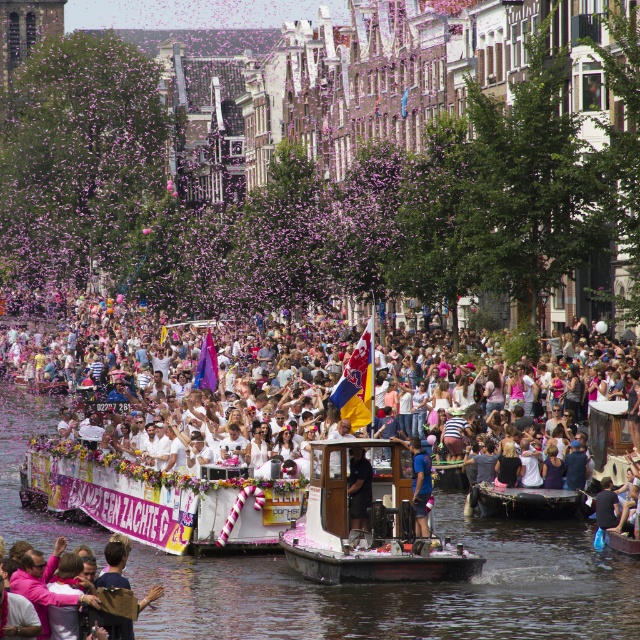
Based on the scene description, where is the white cotton crowd at center located in terms of coordinates?

The white cotton crowd at center is located at coordinates point (177,362).

You are a participant in the canal parade and need to throw a bouquet to the black fabric person at center from the transparent plastic boat at center. Given that the average throwing distance for a bouquet is 8 meters, will you be able to reach them?

The distance between the transparent plastic boat at center and the black fabric person at center is 7.64 meters, which is slightly less than the average throwing distance of 8 meters. Therefore, you should be able to reach them.